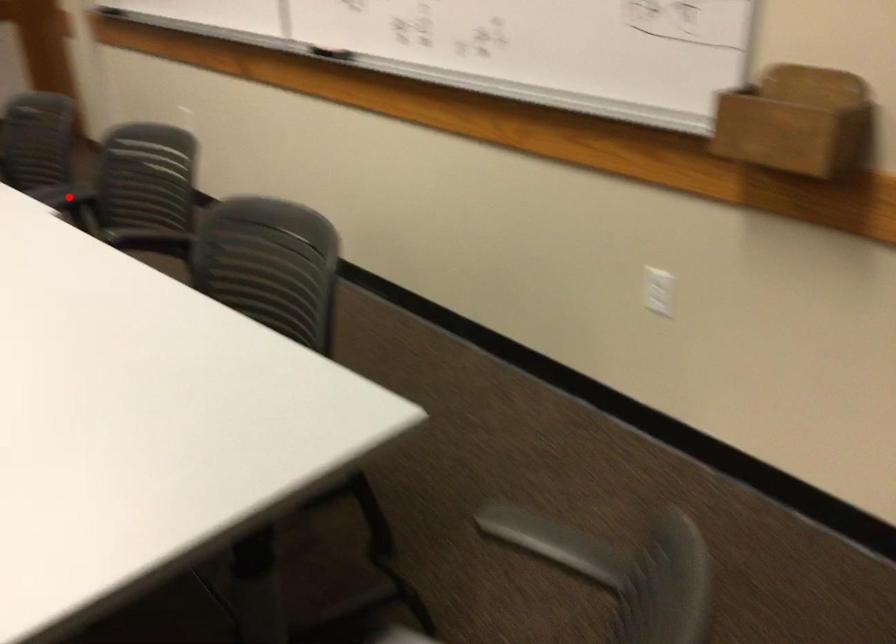
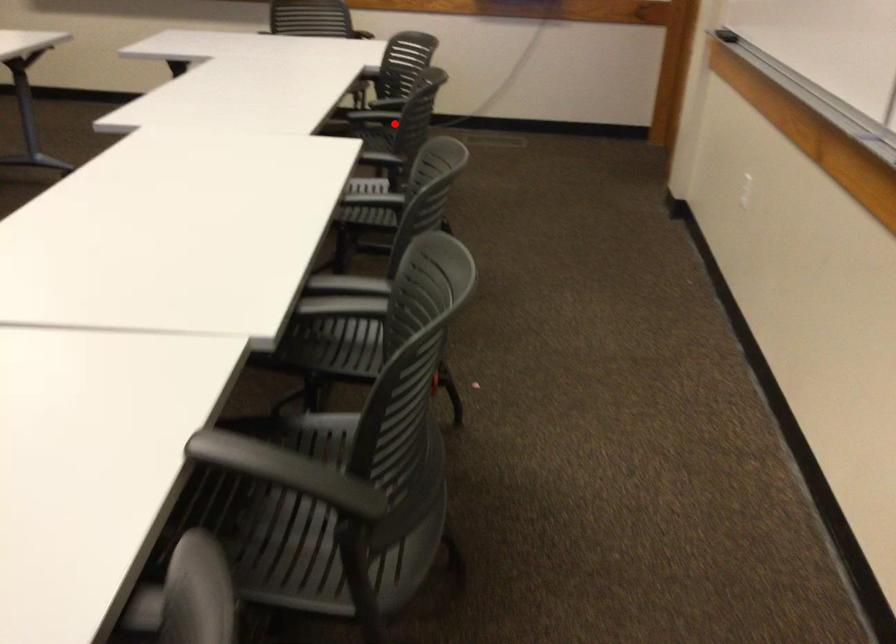
I am providing you with two images of the same scene from different viewpoints. A red point is marked on the first image and another point is marked on the second image. Do the highlighted points in image1 and image2 indicate the same real-world spot?

No